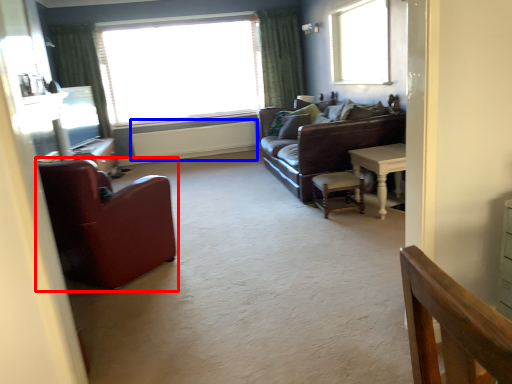
Question: Which object is closer to the camera taking this photo, chair (highlighted by a red box) or radiator (highlighted by a blue box)?

Choices:
 (A) chair
 (B) radiator

Answer: (A)